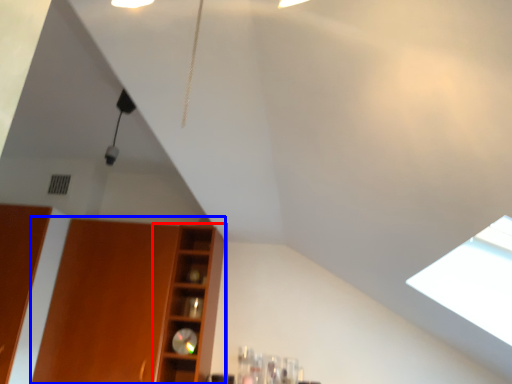
Question: Among these objects, which one is nearest to the camera, shelf (highlighted by a red box) or cabinetry (highlighted by a blue box)?

Choices:
 (A) shelf
 (B) cabinetry

Answer: (B)